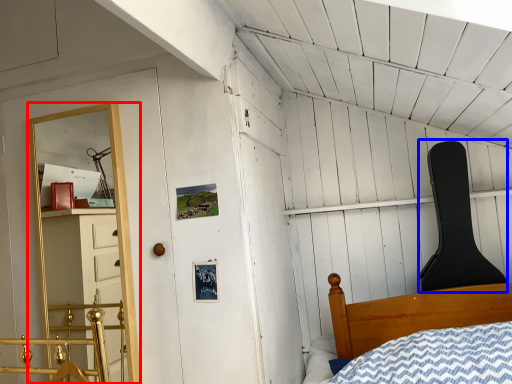
Question: Which object appears closest to the camera in this image, shelf (highlighted by a red box) or chair (highlighted by a blue box)?

Choices:
 (A) shelf
 (B) chair

Answer: (A)